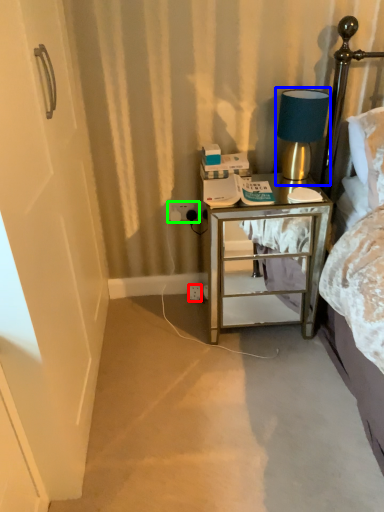
Question: Which object is positioned farthest from electric outlet (highlighted by a red box)? Select from table lamp (highlighted by a blue box) and electric outlet (highlighted by a green box).

Choices:
 (A) table lamp
 (B) electric outlet

Answer: (A)